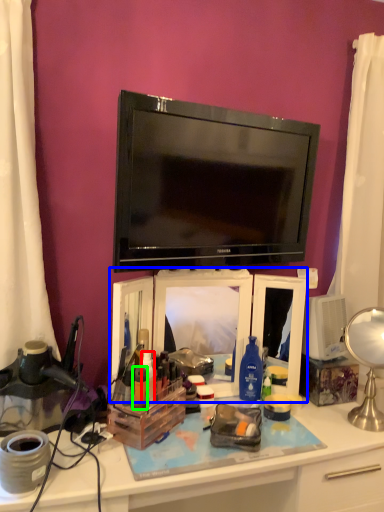
Question: Based on their relative distances, which object is farther from toiletry (highlighted by a red box)? Choose from cabinet (highlighted by a blue box) and toiletry (highlighted by a green box).

Choices:
 (A) cabinet
 (B) toiletry

Answer: (A)